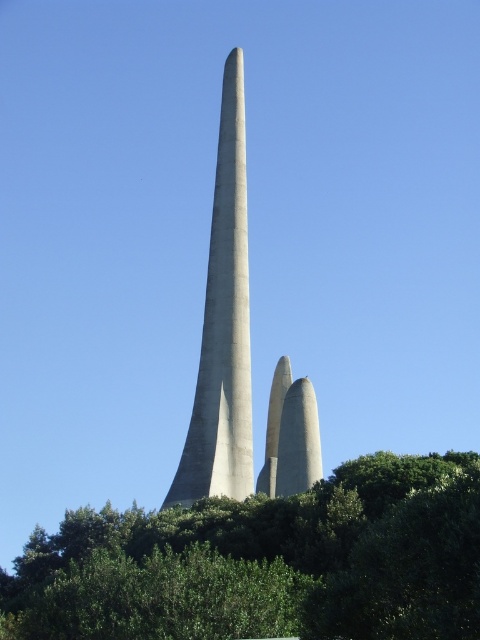
Can you confirm if green leafy tree at center is taller than gray concrete tower at center?

No.

Can you confirm if green leafy tree at center is thinner than gray concrete tower at center?

In fact, green leafy tree at center might be wider than gray concrete tower at center.

Is point (230, 600) positioned in front of point (228, 314)?

Yes, it is.

Locate an element on the screen. green leafy tree at center is located at coordinates (265, 563).

Which of these two, gray concrete tower at center or smooth concrete twin towers at center, stands shorter?

With less height is smooth concrete twin towers at center.

Between gray concrete tower at center and smooth concrete twin towers at center, which one appears on the left side from the viewer's perspective?

From the viewer's perspective, gray concrete tower at center appears more on the left side.

Is point (225, 218) behind point (317, 429)?

Yes, it is behind point (317, 429).

Locate an element on the screen. gray concrete tower at center is located at coordinates (223, 326).

Can you confirm if green leafy tree at center is positioned to the left of smooth concrete twin towers at center?

Indeed, green leafy tree at center is positioned on the left side of smooth concrete twin towers at center.

Is green leafy tree at center bigger than smooth concrete twin towers at center?

Correct, green leafy tree at center is larger in size than smooth concrete twin towers at center.

Does point (264, 636) come farther from viewer compared to point (285, 417)?

That is False.

I want to click on green leafy tree at center, so click(x=265, y=563).